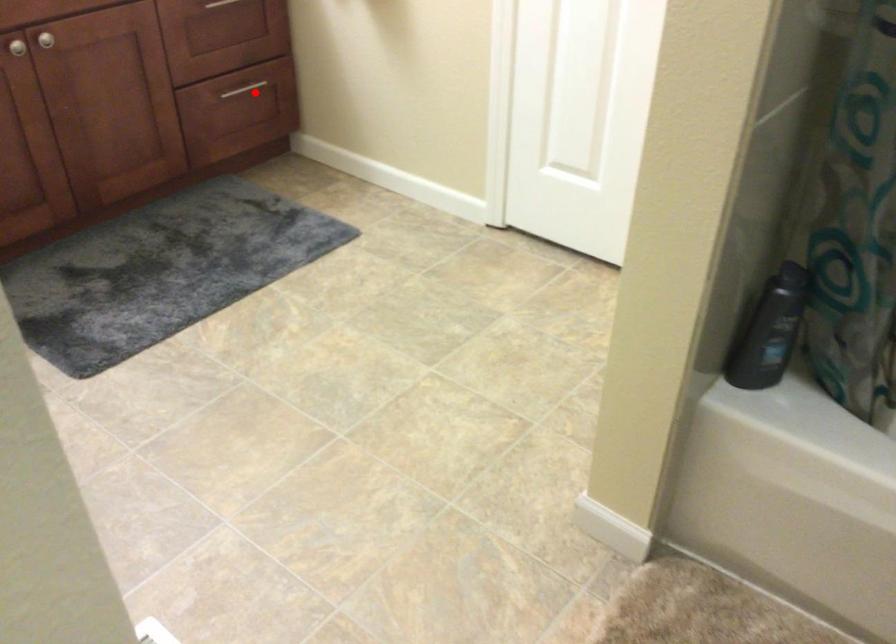
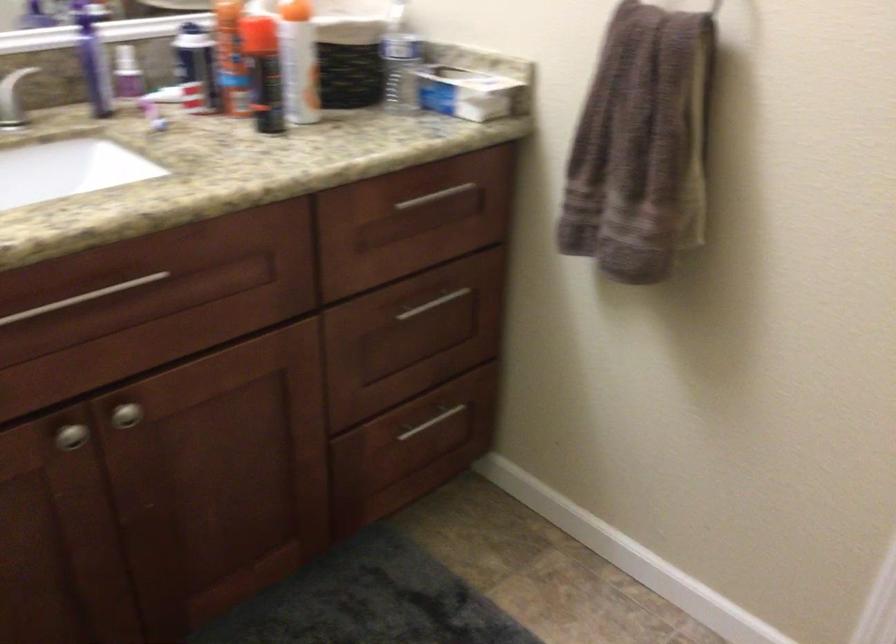
Question: A red point is marked in image1. In image2, is the corresponding 3D point closer to the camera or farther? Reply with the corresponding letter.

Choices:
 (A) The corresponding 3D point is closer.
 (B) The corresponding 3D point is farther.

Answer: (A)